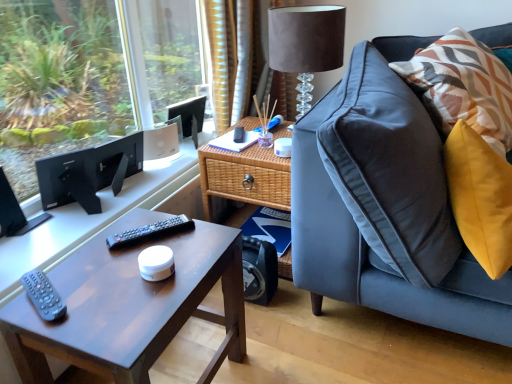
Identify the location of vacant point above suede lampshade at upper right (from a real-world perspective). (300, 6).